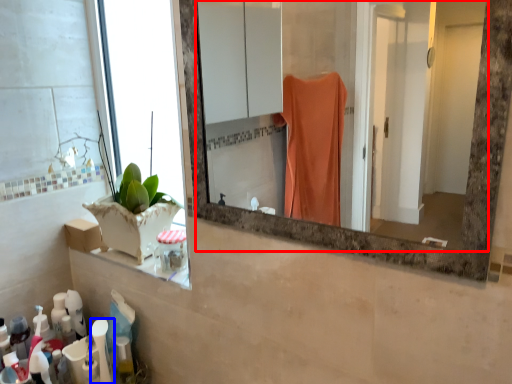
Question: Among these objects, which one is nearest to the camera, mirror (highlighted by a red box) or toiletry (highlighted by a blue box)?

Choices:
 (A) mirror
 (B) toiletry

Answer: (A)